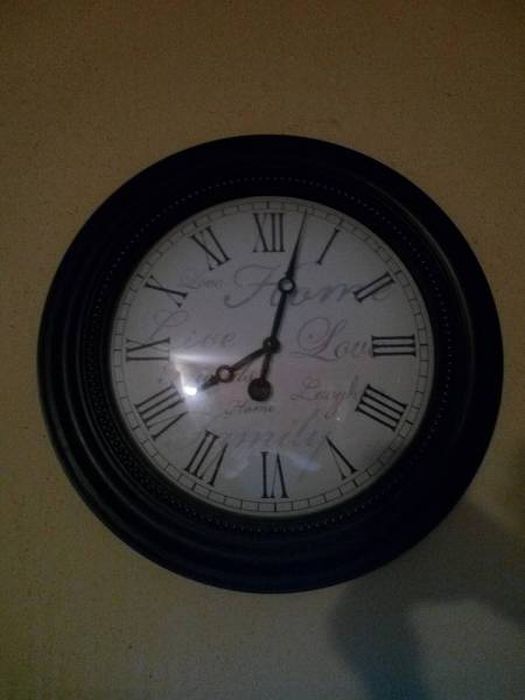
Where is `frame`? The height and width of the screenshot is (700, 525). frame is located at coordinates (217, 544).